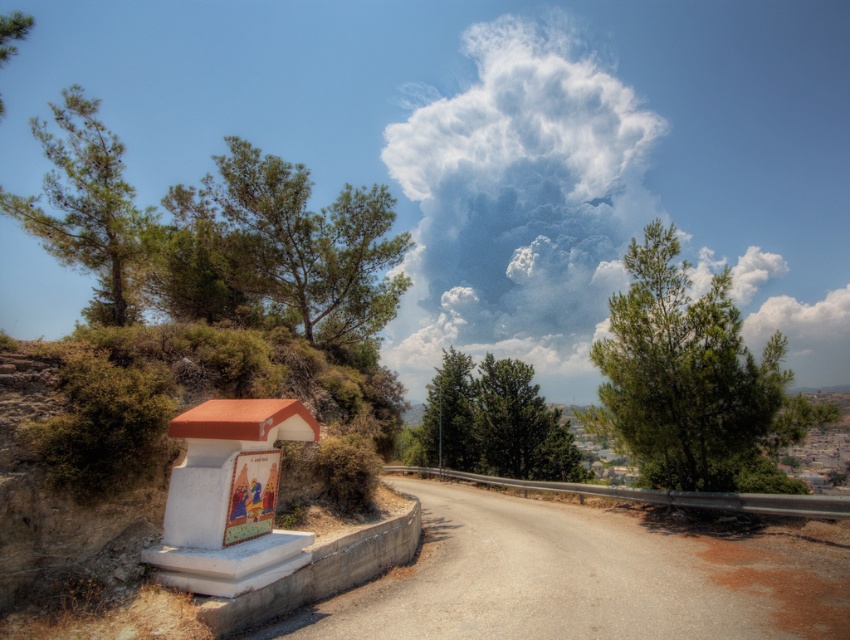
Question: Which point appears closest to the camera in this image?

Choices:
 (A) (536, 273)
 (B) (462, 554)

Answer: (B)

Question: Among these objects, which one is nearest to the camera?

Choices:
 (A) green textured tree at center
 (B) green leafy tree at left
 (C) white fluffy cloud at upper center

Answer: (B)

Question: Can you confirm if gray asphalt highway at lower center is positioned to the right of green leafy tree at center?

Choices:
 (A) yes
 (B) no

Answer: (A)

Question: Which point is closer to the camera?

Choices:
 (A) (714, 637)
 (B) (122, 218)
 (C) (364, 257)
 (D) (456, 392)

Answer: (A)

Question: Can you confirm if gray asphalt highway at lower center is positioned below green needle-like tree at upper center?

Choices:
 (A) no
 (B) yes

Answer: (B)

Question: Does white fluffy cloud at upper center lie behind green leafy tree at upper left?

Choices:
 (A) yes
 (B) no

Answer: (B)